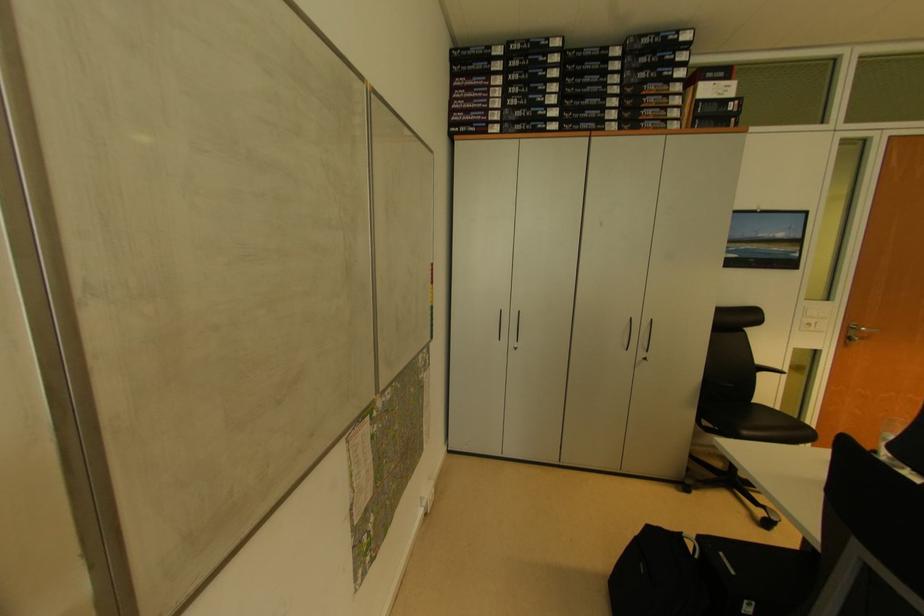
Image resolution: width=924 pixels, height=616 pixels. What do you see at coordinates (648, 123) in the screenshot?
I see `the black product box` at bounding box center [648, 123].